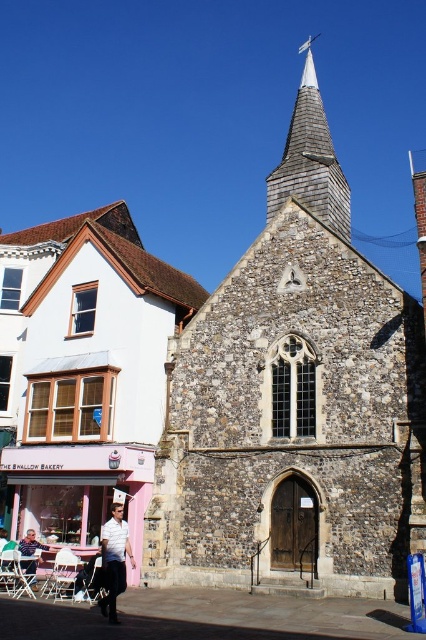
Question: Is shiny gray shingles at upper center further to camera compared to light brown wooden chair at lower left?

Choices:
 (A) yes
 (B) no

Answer: (A)

Question: Is white shirt at center below light brown wooden chair at lower left?

Choices:
 (A) yes
 (B) no

Answer: (B)

Question: Does white shirt at center have a greater width compared to light brown wooden chair at lower left?

Choices:
 (A) yes
 (B) no

Answer: (A)

Question: Which point is closer to the camera?

Choices:
 (A) white shirt at center
 (B) light brown wooden chair at lower left

Answer: (A)

Question: Which object appears closest to the camera in this image?

Choices:
 (A) shiny gray shingles at upper center
 (B) white shirt at center

Answer: (B)

Question: Estimate the real-world distances between objects in this image. Which object is closer to the white shirt at center?

Choices:
 (A) shiny gray shingles at upper center
 (B) light brown wooden chair at lower left

Answer: (B)